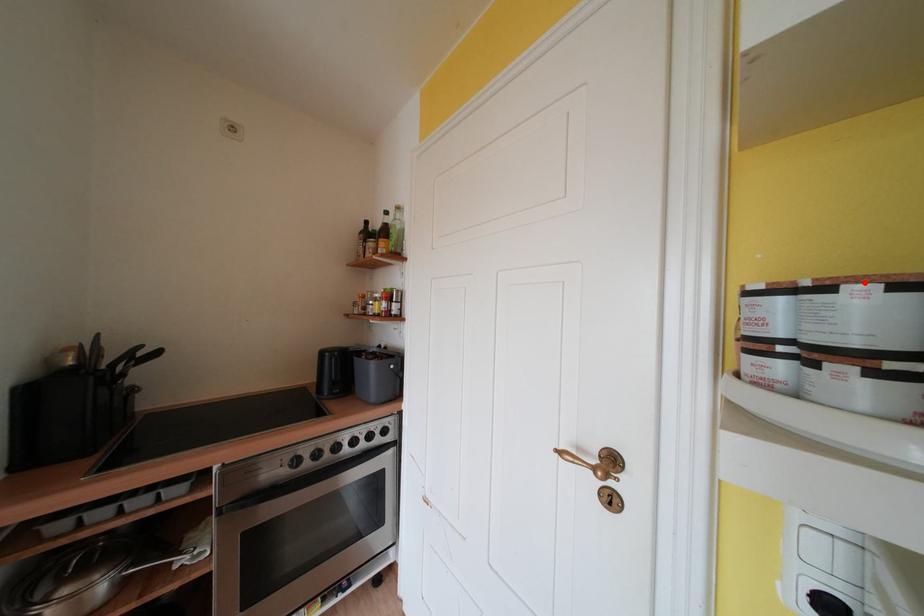
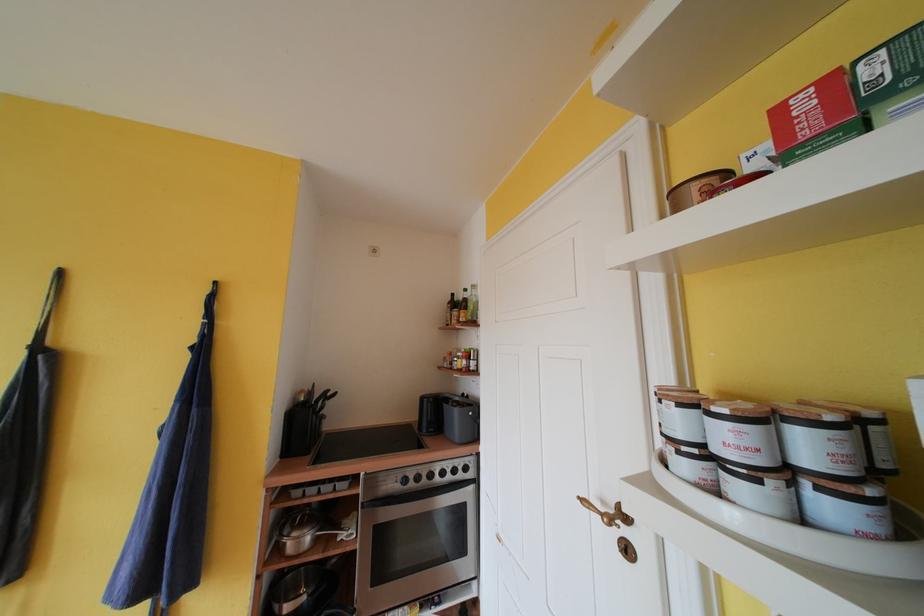
Where in the second image is the point corresponding to the highlighted location from the first image?

(675, 400)